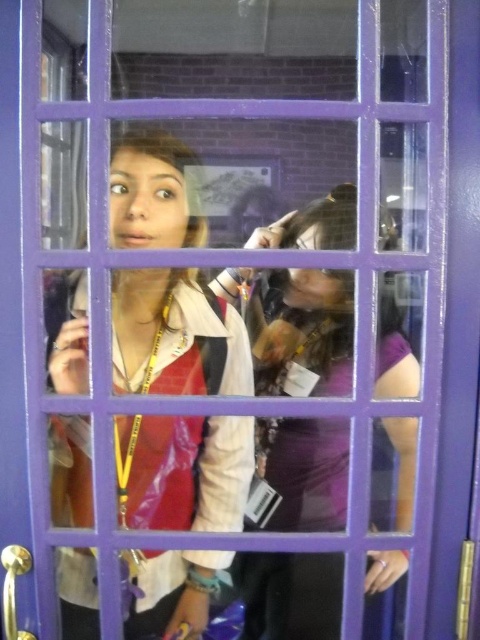
In the scene shown: Is matte white shirt at center to the left of purple matte dress at center from the viewer's perspective?

Indeed, matte white shirt at center is positioned on the left side of purple matte dress at center.

Does point (238, 321) come in front of point (303, 502)?

That is True.

Is point (72, 490) positioned in front of point (397, 554)?

No.

Where is `matte white shirt at center`? This screenshot has width=480, height=640. matte white shirt at center is located at coordinates (176, 336).